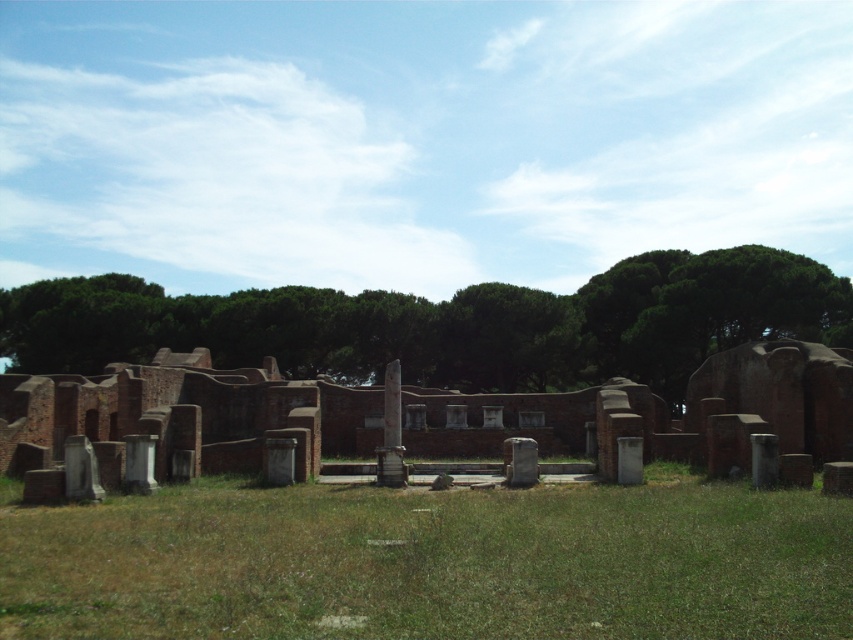
Does green grass at center appear on the left side of green leafy tree at center?

No, green grass at center is not to the left of green leafy tree at center.

Can you confirm if green grass at center is positioned below green leafy tree at center?

Correct, green grass at center is located below green leafy tree at center.

Is point (590, 508) positioned before point (621, 308)?

Yes, point (590, 508) is in front of point (621, 308).

The image size is (853, 640). I want to click on green grass at center, so click(431, 561).

Is point (416, 369) closer to viewer compared to point (48, 412)?

No, (416, 369) is further to viewer.

Who is more forward, (16, 349) or (148, 365)?

Positioned in front is point (148, 365).

Locate an element on the screen. green leafy tree at center is located at coordinates (448, 323).

Which is in front, point (392, 497) or point (757, 410)?

Point (392, 497)

Identify the location of green grass at center. The image size is (853, 640). (x=431, y=561).